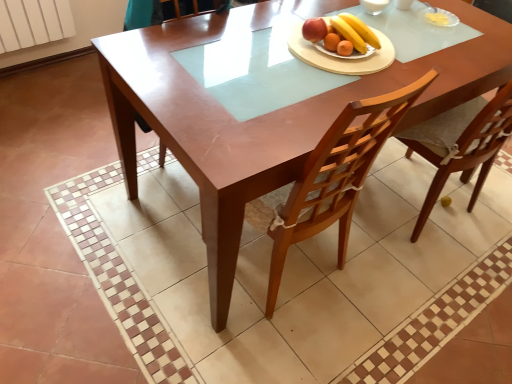
The image size is (512, 384). I want to click on vacant space behind shiny white plate with fruits at center, so tap(332, 14).